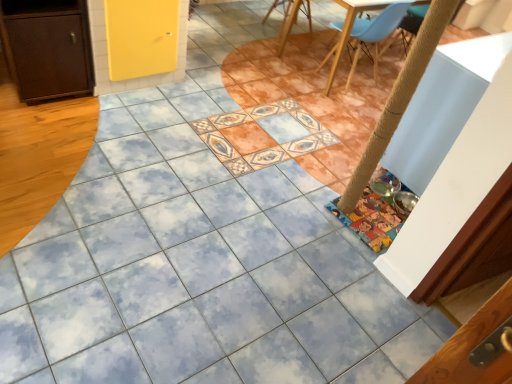
Question: Choose the correct answer: Is light blue plastic chair at upper right, the second chair positioned from the back, inside brown matte cabinet at left or outside it?

Choices:
 (A) outside
 (B) inside

Answer: (A)

Question: In terms of width, does light blue plastic chair at upper right, the second chair positioned from the back, look wider or thinner when compared to brown matte cabinet at left?

Choices:
 (A) thin
 (B) wide

Answer: (B)

Question: Estimate the real-world distances between objects in this image. Which object is closer to the brown matte cabinet at left?

Choices:
 (A) light blue plastic chair at upper right, which is the first chair from right to left
 (B) wooden chair at upper center, the 2th chair positioned from the front

Answer: (A)

Question: Which is farther from the light blue plastic chair at upper right, which ranks as the 1th chair in front-to-back order?

Choices:
 (A) wooden chair at upper center, which ranks as the 1th chair in left-to-right order
 (B) brown matte cabinet at left

Answer: (B)